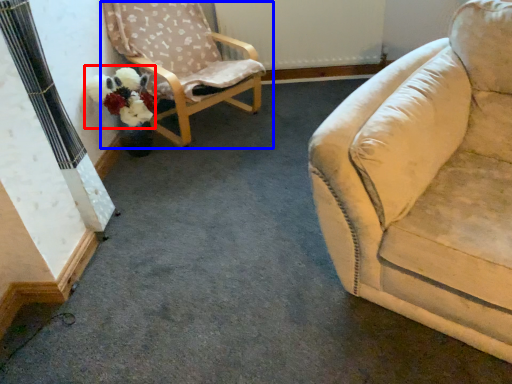
Question: Among these objects, which one is nearest to the camera, flower (highlighted by a red box) or chair (highlighted by a blue box)?

Choices:
 (A) flower
 (B) chair

Answer: (B)